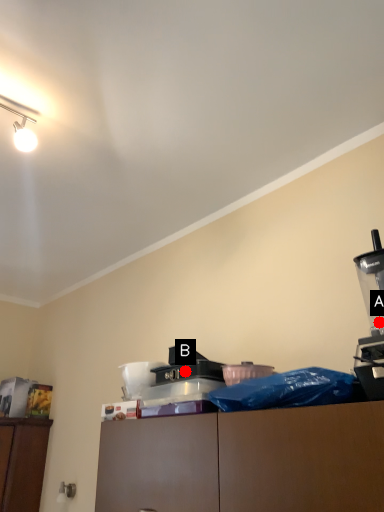
Question: Two points are circled on the image, labeled by A and B beside each circle. Which point is farther to the camera?

Choices:
 (A) A is further
 (B) B is further

Answer: (B)